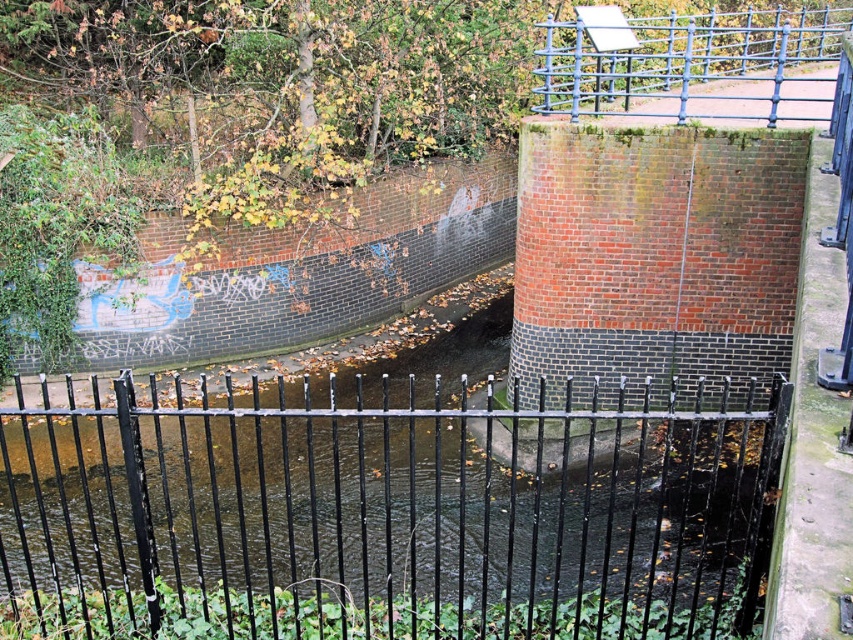
You are standing at the edge of the waterway and see both the black wrought iron fence at center and the blue metal fence at upper right. Which fence is closer to you?

The black wrought iron fence at center is closer to you because it is located below the blue metal fence at upper right, indicating it is in a lower position relative to your viewpoint.

You are standing at the point closest to the viewer between the two points, point [759,604] and point [770,113]. Which point are you standing at?

You are standing at point [759,604] because it is in front of point [770,113].

You are a painter who wants to paint both the black wrought iron fence at center and the blue metal fence at upper right. Which fence requires more paint due to its greater width?

The blue metal fence at upper right requires more paint because it has a greater width than the black wrought iron fence at center.